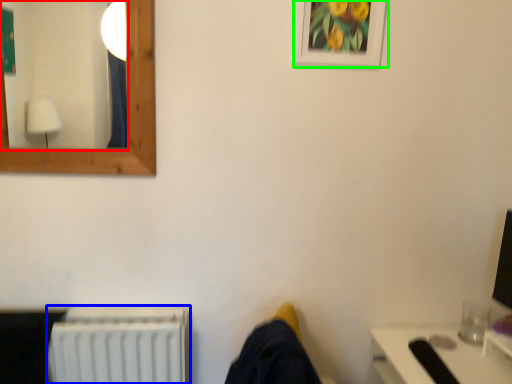
Question: Which object is the closest to the mirror (highlighted by a red box)? Choose among these: radiator (highlighted by a blue box) or picture frame (highlighted by a green box).

Choices:
 (A) radiator
 (B) picture frame

Answer: (A)